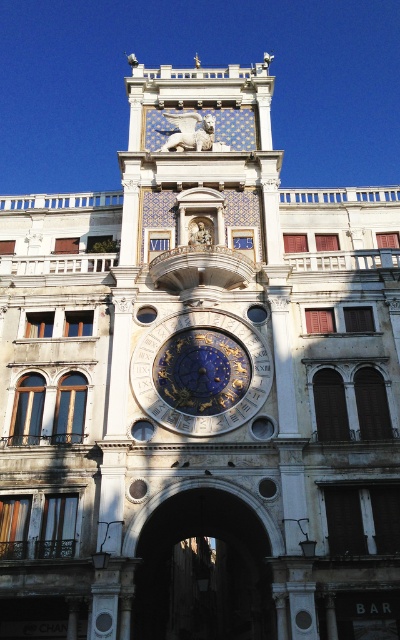
You are an architect visiting this historic building and want to know about its architectural features. Which object is taller between the dark stone archway at center and the blue metallic clock at center?

The dark stone archway at center is taller than the blue metallic clock at center.

You are standing in front of the grand architectural structure described in the scene. You notice the dark stone archway at center. Can you provide the coordinates where this archway is located?

The dark stone archway at center is located at coordinates point (x=202, y=572).